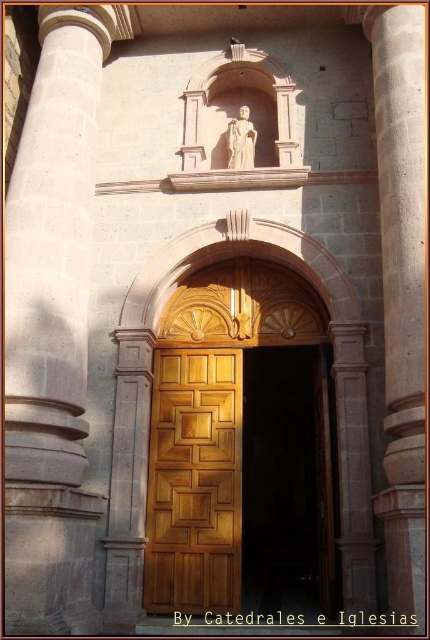
Question: Does gray stone column at center have a smaller size compared to wooden door at center?

Choices:
 (A) no
 (B) yes

Answer: (B)

Question: Where is gray stone column at center located in relation to brown stone column at center in the image?

Choices:
 (A) right
 (B) left

Answer: (B)

Question: Can you confirm if gray stone column at center is thinner than matte stone statue at upper center?

Choices:
 (A) yes
 (B) no

Answer: (B)

Question: Which of the following is the farthest from the observer?

Choices:
 (A) (245, 120)
 (B) (58, 276)

Answer: (A)

Question: Which object appears closest to the camera in this image?

Choices:
 (A) wooden door at center
 (B) matte stone statue at upper center
 (C) gray stone column at center
 (D) polished wood door at center

Answer: (C)

Question: Which of the following is the closest to the observer?

Choices:
 (A) polished wood door at center
 (B) gray stone column at center

Answer: (B)